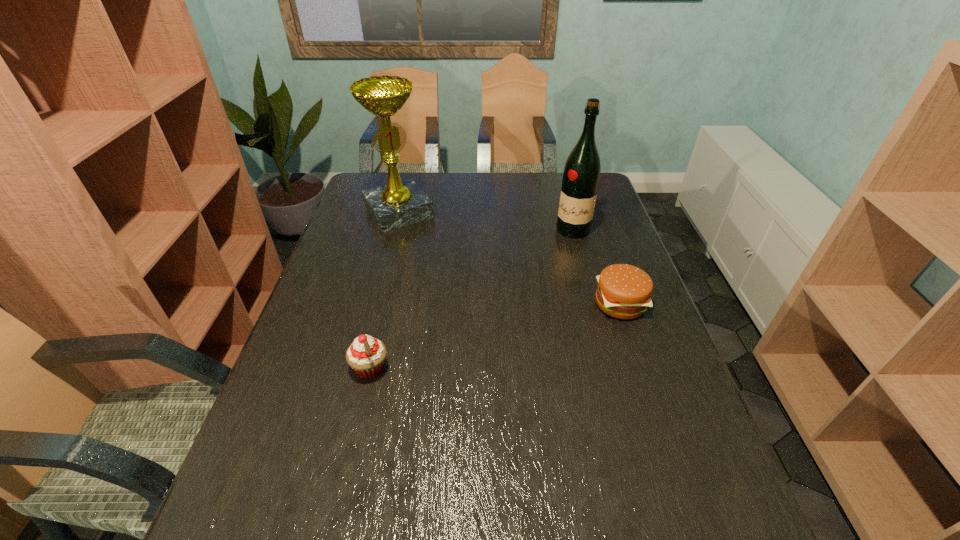
Find the location of a particular element. free space on the desktop that is between the third tallest object and the hamburger and is positioned on the front-facing side of the award is located at coordinates (496, 335).

Find the location of `vacant space on the desktop that is between the second shortest object and the hamburger and is positioned on the front-facing side of the liquor`. vacant space on the desktop that is between the second shortest object and the hamburger and is positioned on the front-facing side of the liquor is located at coordinates (499, 335).